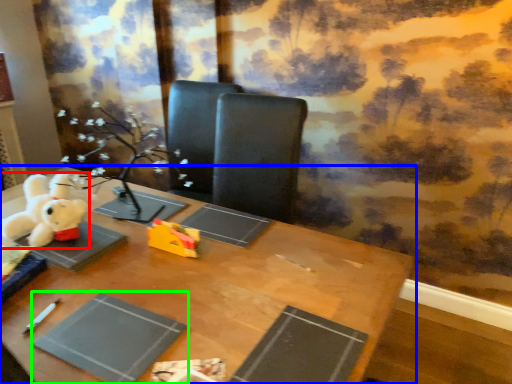
Question: Which object is positioned closest to toy (highlighted by a red box)? Select from table (highlighted by a blue box) and paperback book (highlighted by a green box).

Choices:
 (A) table
 (B) paperback book

Answer: (A)